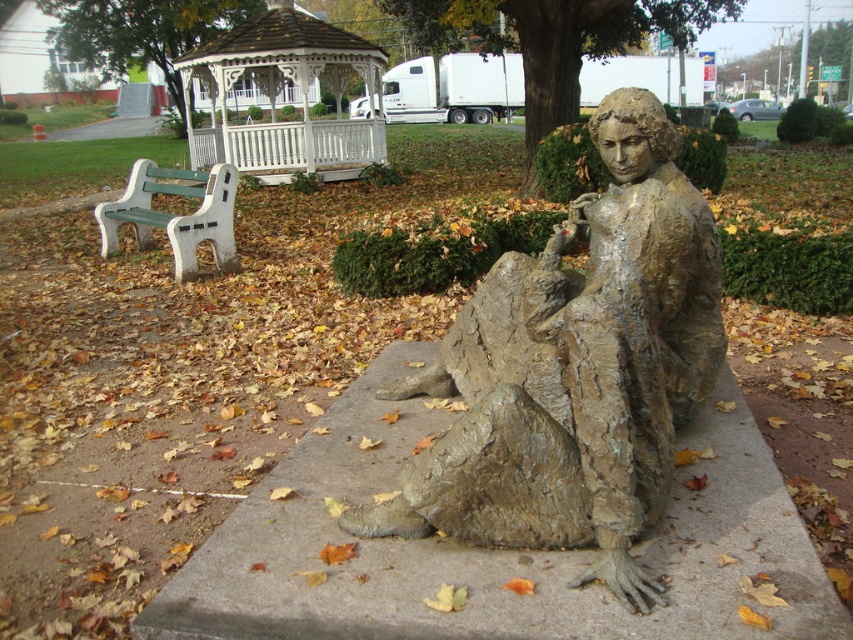
Question: Can you confirm if bronze textured statue at center is positioned to the right of white wood gazebo at upper center?

Choices:
 (A) no
 (B) yes

Answer: (B)

Question: Estimate the real-world distances between objects in this image. Which object is farther from the rough concrete statue at center?

Choices:
 (A) white wood gazebo at upper center
 (B) bronze textured statue at center
 (C) green plastic bench at left

Answer: (A)

Question: Estimate the real-world distances between objects in this image. Which object is farther from the green plastic bench at left?

Choices:
 (A) white wood gazebo at upper center
 (B) rough concrete statue at center
 (C) bronze textured statue at center

Answer: (A)

Question: Observing the image, what is the correct spatial positioning of rough concrete statue at center in reference to green plastic bench at left?

Choices:
 (A) left
 (B) right

Answer: (B)

Question: Which point is closer to the camera taking this photo?

Choices:
 (A) (329, 177)
 (B) (543, 625)
 (C) (183, 189)

Answer: (B)

Question: Can you confirm if bronze textured statue at center is positioned to the right of green plastic bench at left?

Choices:
 (A) no
 (B) yes

Answer: (B)